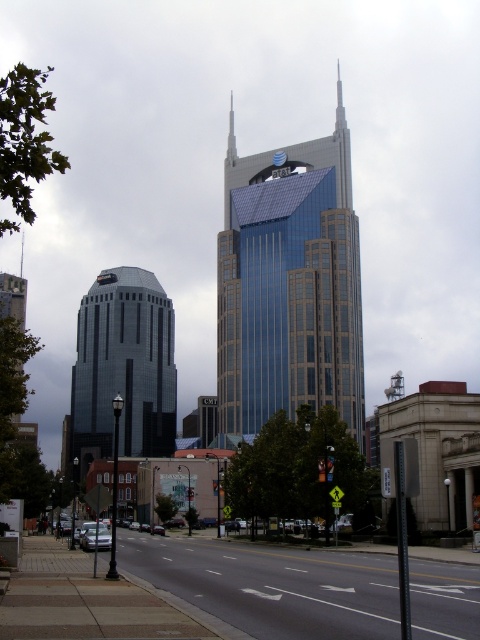
This screenshot has height=640, width=480. What do you see at coordinates (289, 285) in the screenshot?
I see `shiny glass skyscraper at center` at bounding box center [289, 285].

Is shiny glass skyscraper at center to the right of shiny glass skyscraper at left from the viewer's perspective?

Correct, you'll find shiny glass skyscraper at center to the right of shiny glass skyscraper at left.

Which is in front, point (240, 193) or point (162, 371)?

Positioned in front is point (240, 193).

Identify the location of shiny glass skyscraper at center. Image resolution: width=480 pixels, height=640 pixels. click(x=289, y=285).

Which is more to the left, shiny glass skyscraper at center or smooth silver spire at upper center?

smooth silver spire at upper center is more to the left.

Which is behind, point (339, 182) or point (228, 161)?

The point (228, 161) is more distant.

Does point (229, 280) come closer to viewer compared to point (228, 161)?

Yes, it is.

Locate an element on the screen. This screenshot has height=640, width=480. shiny glass skyscraper at center is located at coordinates (289, 285).

Which is in front, point (327, 308) or point (23, 252)?

Point (327, 308)

Does shiny glass skyscraper at center have a larger size compared to metallic silver spire at center?

Yes.

Locate an element on the screen. Image resolution: width=480 pixels, height=640 pixels. shiny glass skyscraper at center is located at coordinates (289, 285).